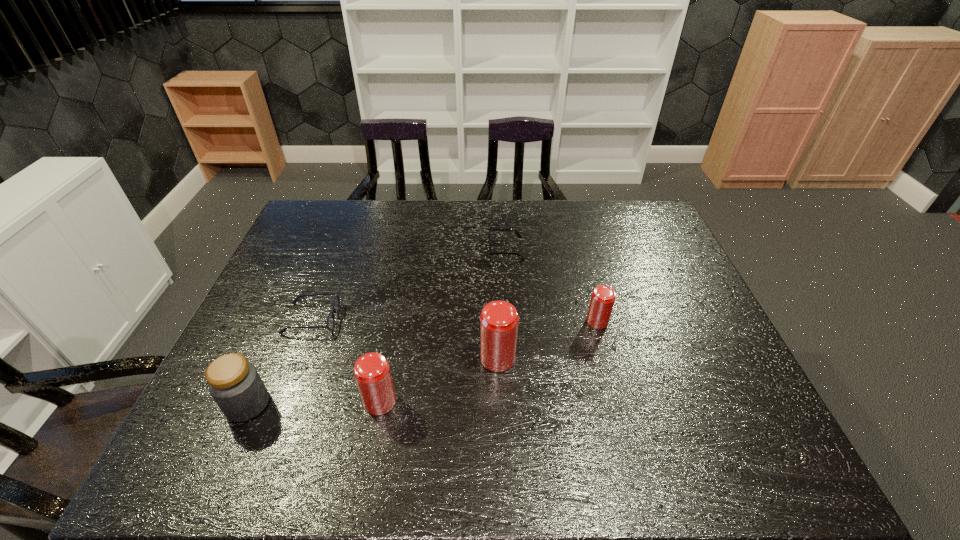
With all beer cans evenly spaced, where should an extra beer can be placed on the right to continue the pattern? Please point out a vacant space. Please provide its 2D coordinates. Your answer should be formatted as a tuple, i.e. [(x, y)], where the tuple contains the x and y coordinates of a point satisfying the conditions above.

[(683, 290)]